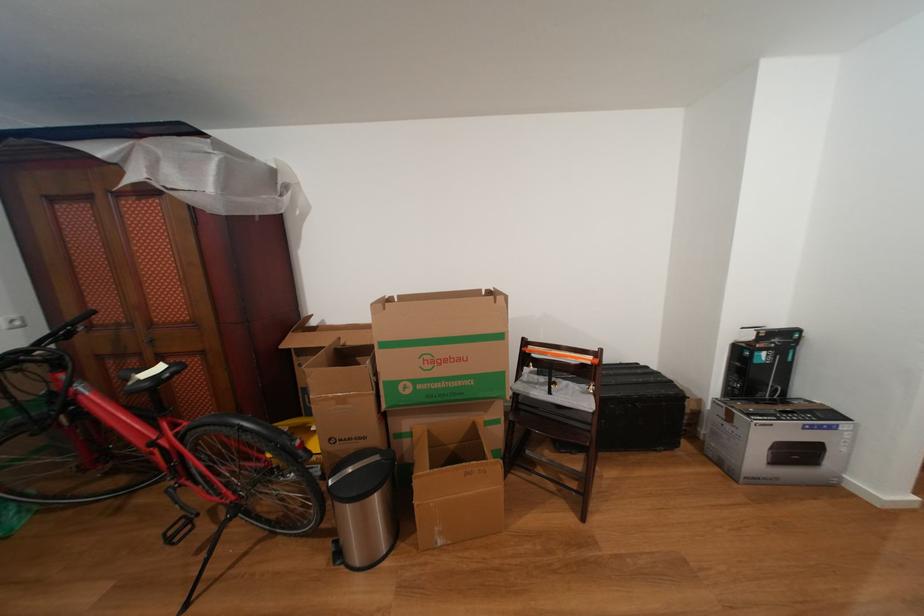
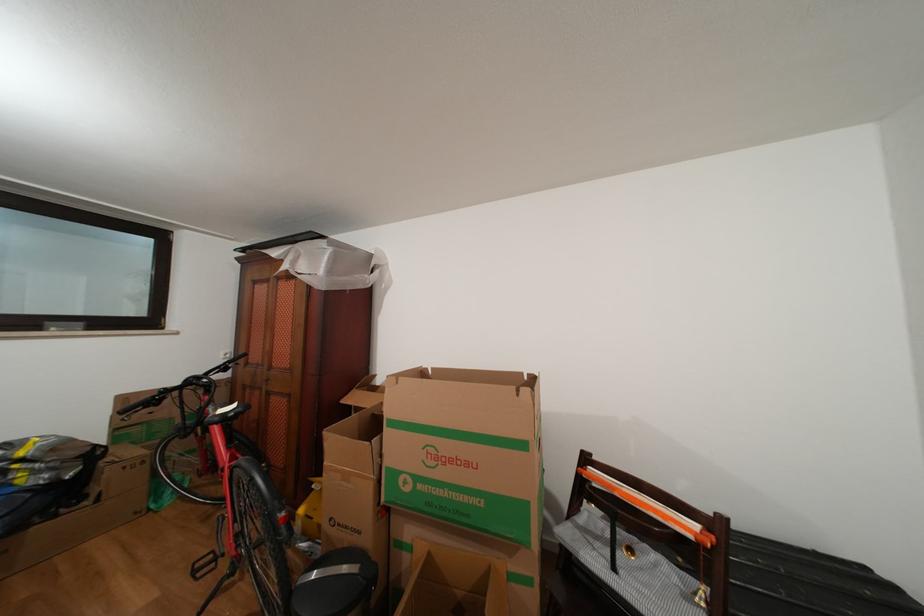
What movement of the cameraman would produce the second image?

The movement direction of the cameraman is right, forward.